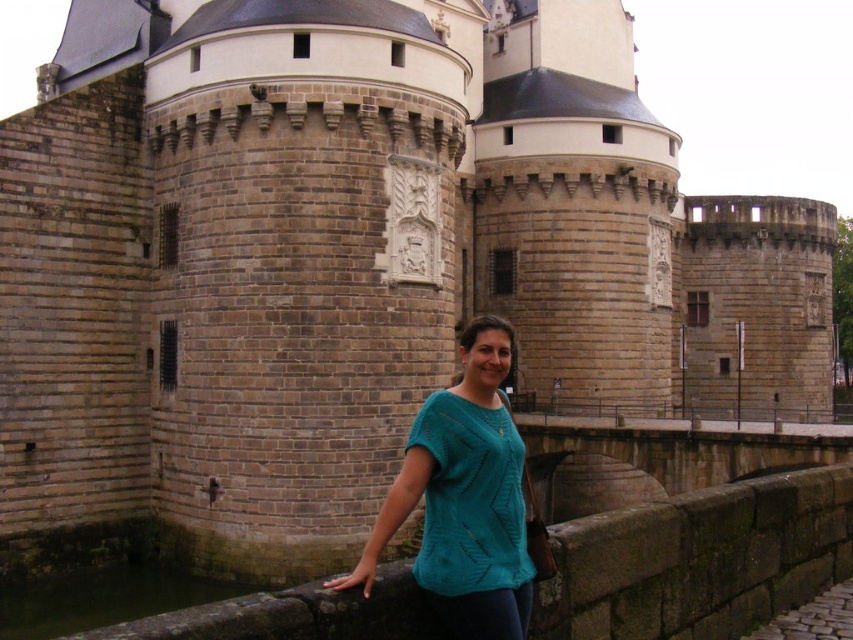
You are a tour guide leading a group near the historic stone structure. You want to ensure visitors can safely walk from the teal knitted shirt at center to the dark brown water at lower left. Given that the average walking distance for a group is 15 meters, will the group be able to walk this path comfortably?

The distance between the teal knitted shirt at center and the dark brown water at lower left is 16.13 meters, which exceeds the average walking distance of 15 meters. Therefore, the group may find the path slightly longer than comfortable, but it is still feasible to walk the distance.

You are a tour guide explaining the historical site to visitors. You point out the teal knitted shirt at center and the dark brown water at lower left. Which object is closer to the visitors?

The teal knitted shirt at center is closer to the visitors because it is in front of the dark brown water at lower left.

You are a tourist visiting the historic stone structure. You notice the teal knitted shirt at center and the dark brown water at lower left. Which object is positioned higher in the image?

The teal knitted shirt at center is located above dark brown water at lower left, so the teal knitted shirt at center is positioned higher in the image.